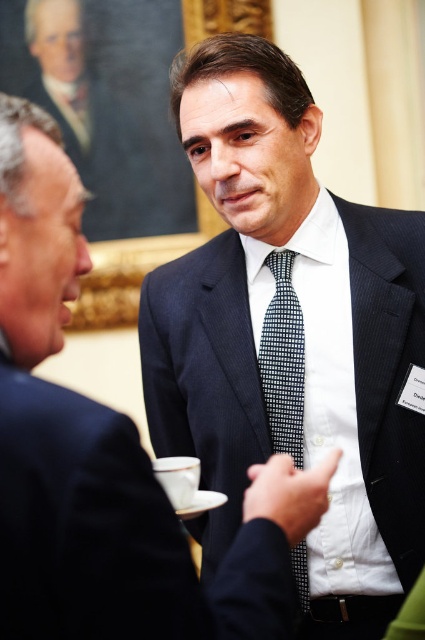
Question: In this image, where is navy blue suit at center located relative to navy wool suit at center?

Choices:
 (A) below
 (B) above

Answer: (B)

Question: Does navy blue suit at center have a larger size compared to dark blue textured tie at center?

Choices:
 (A) yes
 (B) no

Answer: (A)

Question: Which point is closer to the camera?

Choices:
 (A) dark blue textured tie at center
 (B) navy blue suit at center
 (C) navy wool suit at center

Answer: (B)

Question: Considering the real-world distances, which object is closest to the navy wool suit at center?

Choices:
 (A) dark blue textured tie at center
 (B) dark blue suit at center

Answer: (A)

Question: Which point appears closest to the camera in this image?

Choices:
 (A) (78, 401)
 (B) (325, 422)

Answer: (A)

Question: Does navy wool suit at center have a lesser width compared to dark blue textured tie at center?

Choices:
 (A) no
 (B) yes

Answer: (A)